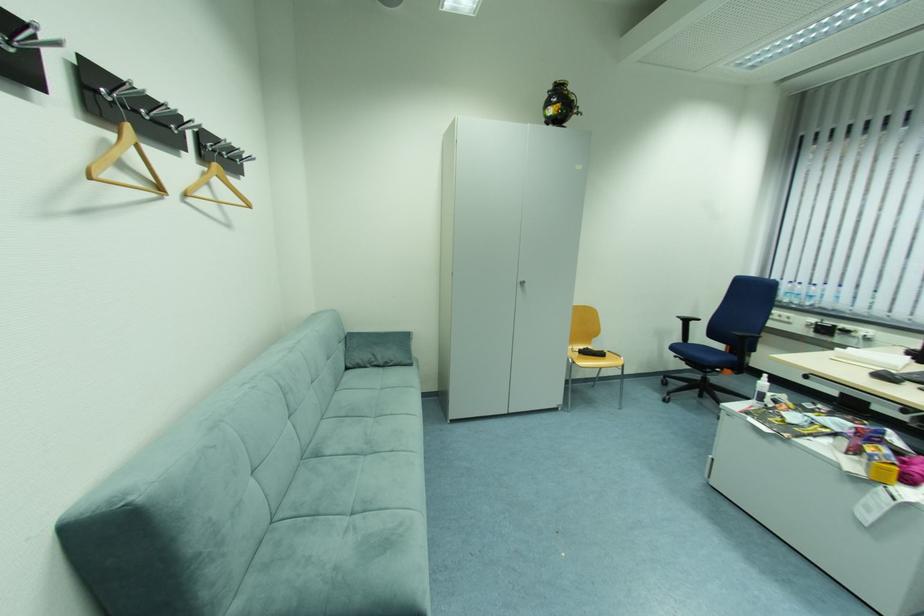
Where would you pull the cabinet handle? Please return your answer as a coordinate pair (x, y).

(524, 285)